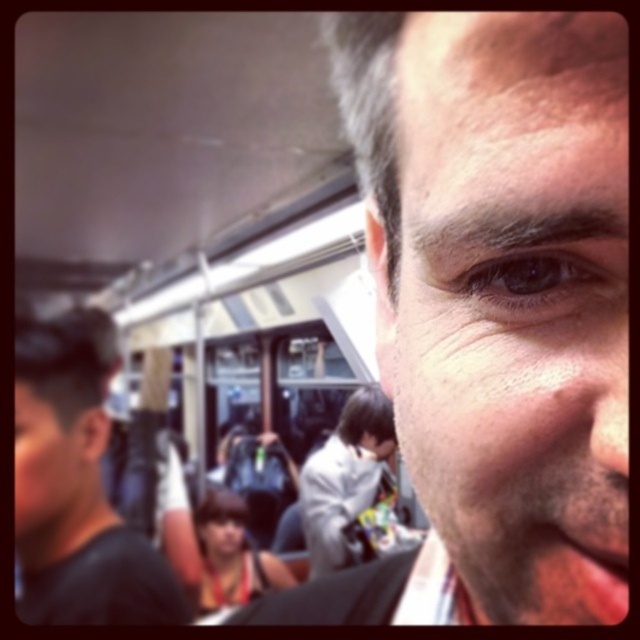
Question: Is white matte jacket at center smaller than smooth skin face at center?

Choices:
 (A) no
 (B) yes

Answer: (A)

Question: Is brown matte eye at center wider than smooth skin face at center?

Choices:
 (A) no
 (B) yes

Answer: (A)

Question: Which point appears closest to the camera in this image?

Choices:
 (A) (600, 324)
 (B) (554, 273)
 (C) (208, 524)
 (D) (317, 541)

Answer: (A)

Question: Which point appears farthest from the camera in this image?

Choices:
 (A) (65, 582)
 (B) (502, 288)
 (C) (339, 538)
 (D) (412, 346)

Answer: (C)

Question: Which point is closer to the camera taking this photo?

Choices:
 (A) (577, 579)
 (B) (243, 524)

Answer: (A)

Question: Does white matte jacket at center appear over brown matte eye at center?

Choices:
 (A) no
 (B) yes

Answer: (A)